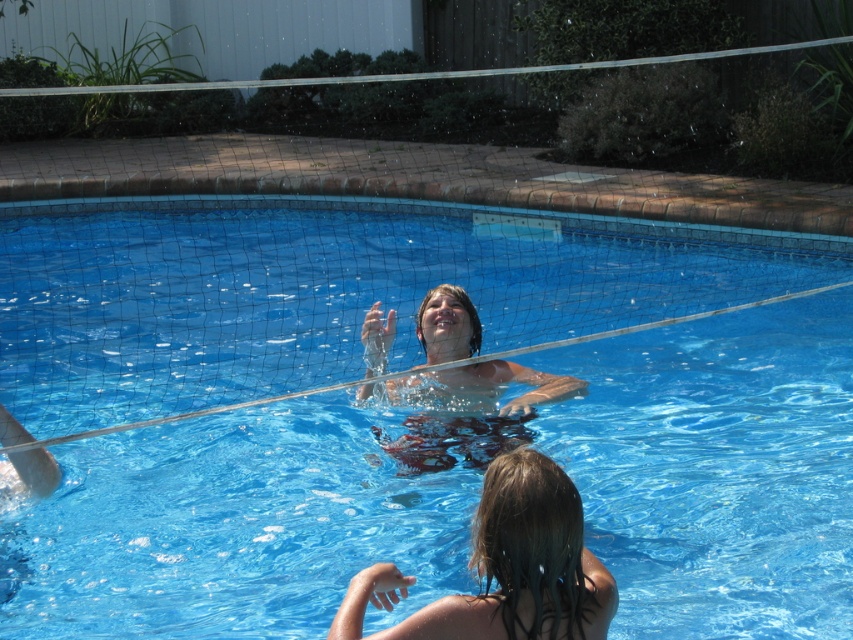
Does transparent blue water at center have a greater height compared to wet hair at lower center?

Indeed, transparent blue water at center has a greater height compared to wet hair at lower center.

Is point (24, 561) positioned in front of point (548, 548)?

No, it is not.

Locate an element on the screen. Image resolution: width=853 pixels, height=640 pixels. transparent blue water at center is located at coordinates (286, 388).